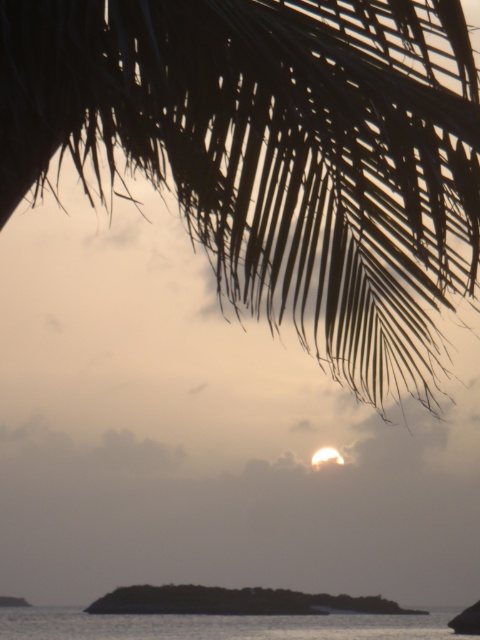
Question: From the image, what is the correct spatial relationship of silky black palm fronds at upper center in relation to transparent water at lower center?

Choices:
 (A) above
 (B) below

Answer: (A)

Question: In this image, where is silky black palm fronds at upper center located relative to transparent water at lower center?

Choices:
 (A) above
 (B) below

Answer: (A)

Question: Which point is farther to the camera?

Choices:
 (A) (357, 625)
 (B) (459, 209)

Answer: (A)

Question: Which point appears farthest from the camera in this image?

Choices:
 (A) (478, 108)
 (B) (57, 609)

Answer: (B)

Question: Where is silky black palm fronds at upper center located in relation to transparent water at lower center in the image?

Choices:
 (A) right
 (B) left

Answer: (A)